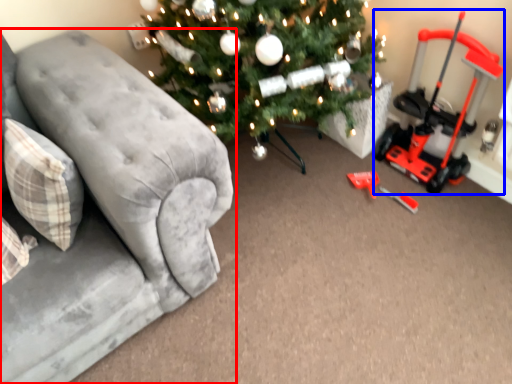
Question: Among these objects, which one is nearest to the camera, studio couch (highlighted by a red box) or equipment (highlighted by a blue box)?

Choices:
 (A) studio couch
 (B) equipment

Answer: (A)